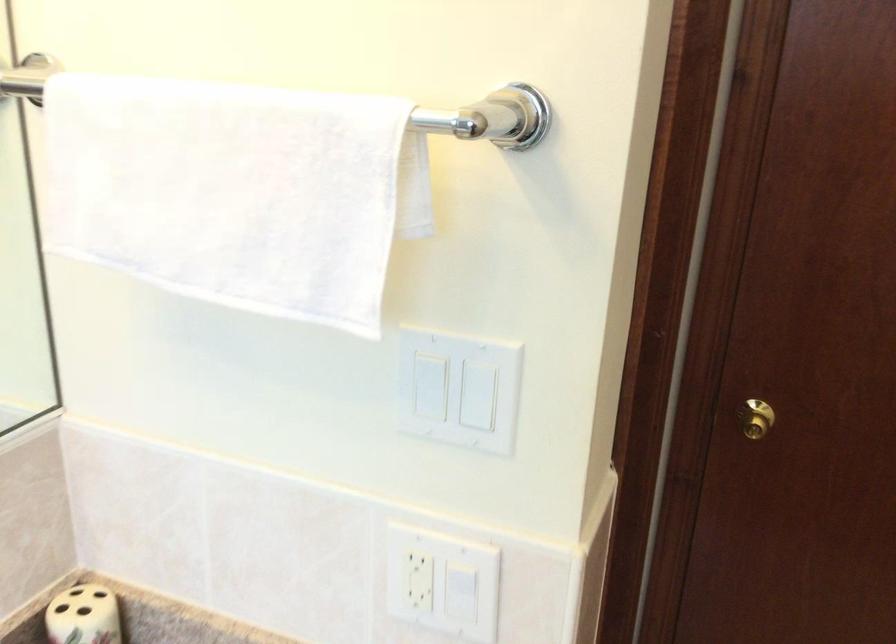
The image size is (896, 644). What do you see at coordinates (754, 418) in the screenshot?
I see `the gold door knob` at bounding box center [754, 418].